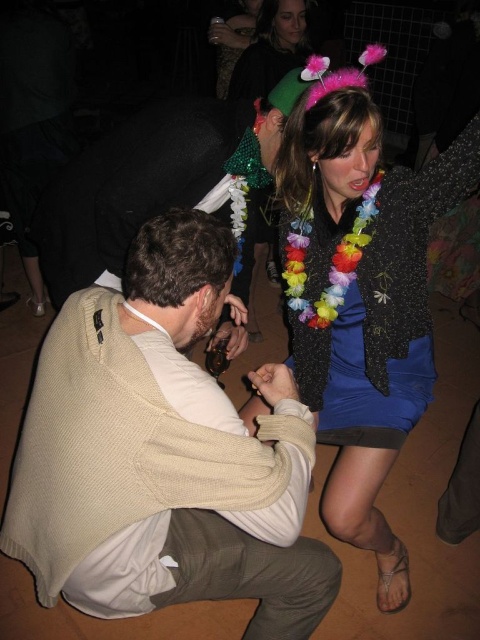
You are a photographer at the event and need to capture a photo that includes both the sparkly black jacket at upper right and the beige sweater at lower left. Which object should you position on the right side of your frame to ensure both are visible?

You should position the sparkly black jacket at upper right on the right side of your frame because it is already on the right side of the beige sweater at lower left, ensuring both are visible.

You are at a party and want to find the sparkly black jacket at upper right and the beige sweater at lower left. Based on their positions, which one is closer to the bottom of the image?

The sparkly black jacket at upper right is below the beige sweater at lower left, so it is closer to the bottom of the image.